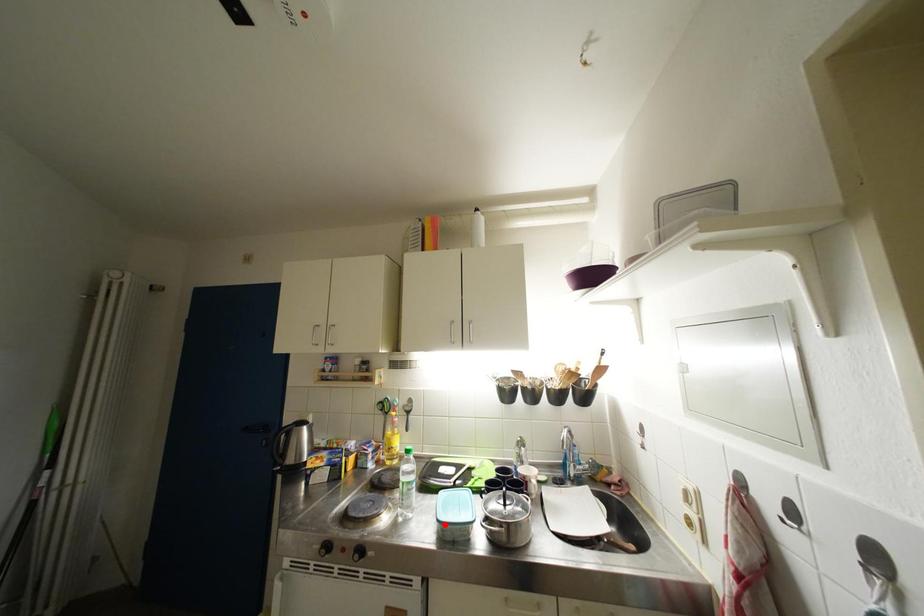
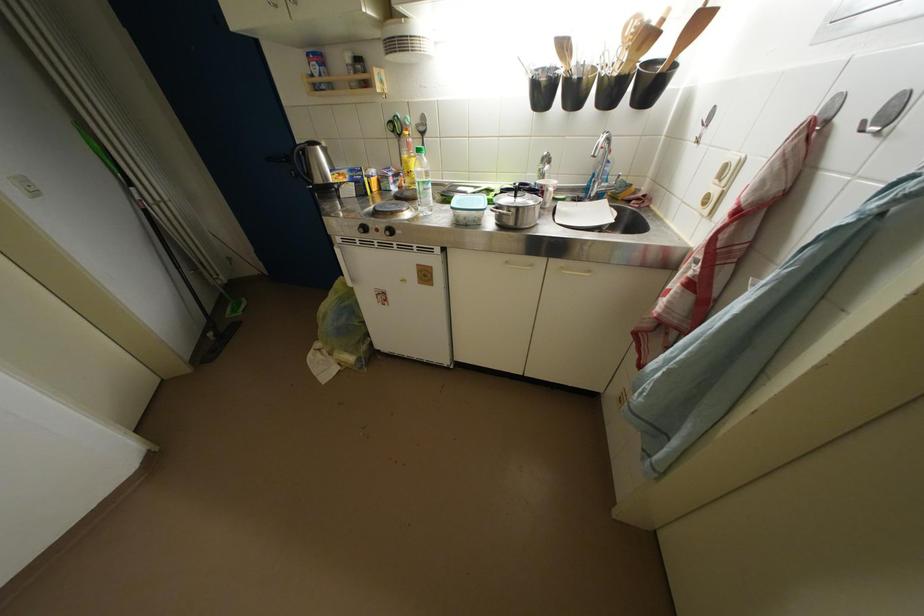
Locate, in the second image, the point that corresponds to the highlighted location in the first image.

(458, 212)